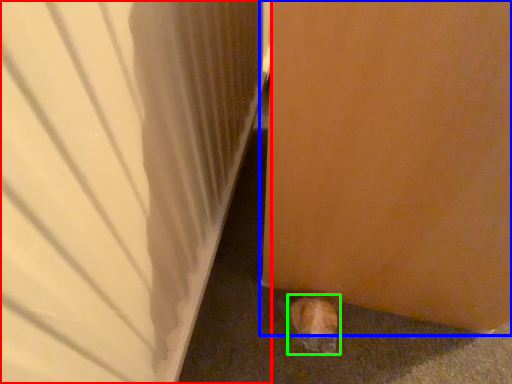
Question: Which object is positioned farthest from door (highlighted by a red box)? Select from door (highlighted by a blue box) and animal (highlighted by a green box).

Choices:
 (A) door
 (B) animal

Answer: (B)